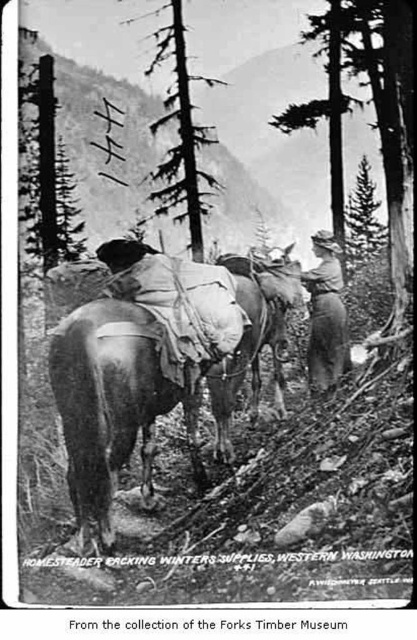
Question: Is smooth bark tree at center to the left of brown leather hat at center from the viewer's perspective?

Choices:
 (A) yes
 (B) no

Answer: (A)

Question: Based on their relative distances, which object is farther from the brown leather hat at center?

Choices:
 (A) smooth bark tree at center
 (B) brown leather saddle at center
 (C) green leafy tree at upper center

Answer: (A)

Question: Does smooth bark tree at center lie in front of brown leather hat at center?

Choices:
 (A) no
 (B) yes

Answer: (A)

Question: Is brown leather saddle at center bigger than smooth bark tree at center?

Choices:
 (A) yes
 (B) no

Answer: (A)

Question: Which point is farther from the camera taking this photo?

Choices:
 (A) (125, 22)
 (B) (122, 465)

Answer: (A)

Question: Which object appears closest to the camera in this image?

Choices:
 (A) smooth bark tree at center
 (B) green leafy tree at upper center
 (C) brown leather saddle at center
 (D) brown leather hat at center

Answer: (C)